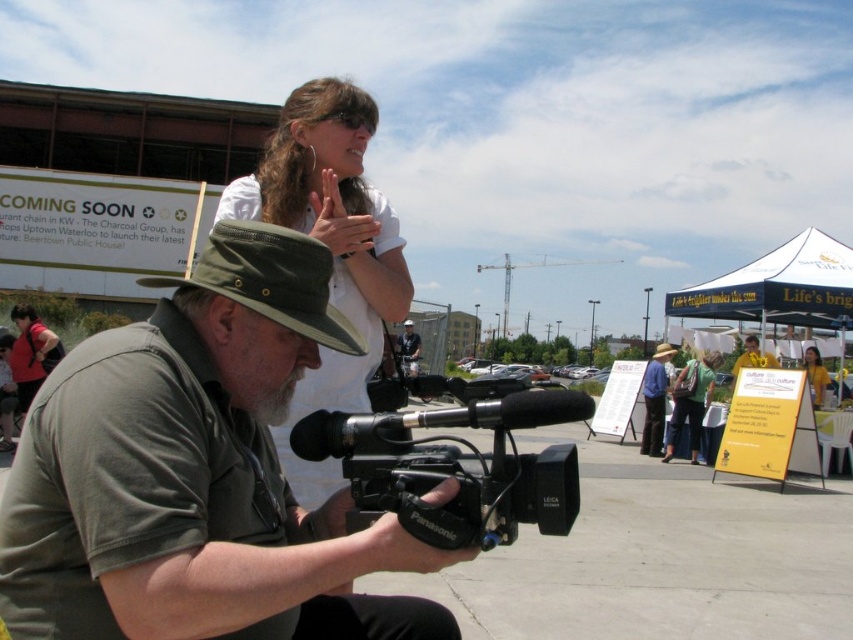
Question: Can you confirm if green canvas hat at center is thinner than yellow fabric shirt at center?

Choices:
 (A) yes
 (B) no

Answer: (A)

Question: Does black plastic video camera at center appear under matte red shirt at lower left?

Choices:
 (A) yes
 (B) no

Answer: (B)

Question: Is blue denim shirt at center wider than metallic silver helmet at center?

Choices:
 (A) yes
 (B) no

Answer: (A)

Question: Which of these objects is positioned closest to the yellow fabric shirt at upper center?

Choices:
 (A) yellow fabric shirt at center
 (B) matte red shirt at lower left

Answer: (A)

Question: Among these objects, which one is farthest from the camera?

Choices:
 (A) green canvas hat at center
 (B) matte red shirt at lower left
 (C) green fabric backpack at center
 (D) blue denim shirt at center

Answer: (D)

Question: Which object appears farthest from the camera in this image?

Choices:
 (A) yellow fabric shirt at upper center
 (B) yellow fabric shirt at center
 (C) metallic silver helmet at center
 (D) blue denim shirt at center

Answer: (D)